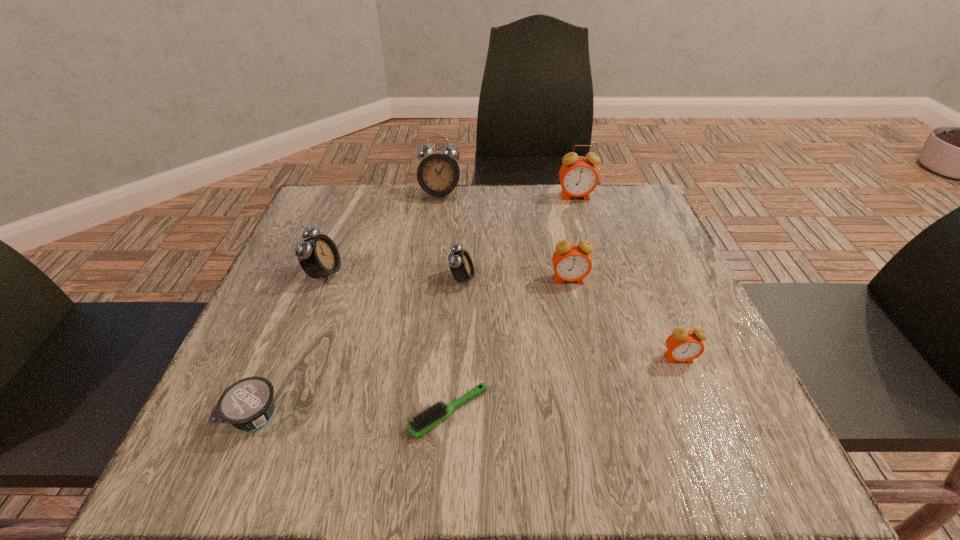
In the image, there is a desktop. Where is `vacant region at the near right corner`? The image size is (960, 540). vacant region at the near right corner is located at coordinates (780, 467).

At what (x,y) coordinates should I click in order to perform the action: click on empty location between the smallest white alarm clock and the seventh tallest object. Please return your answer as a coordinate pair (x, y). This screenshot has height=540, width=960. Looking at the image, I should click on (359, 347).

At what (x,y) coordinates should I click in order to perform the action: click on empty location between the smallest white alarm clock and the seventh tallest object. Please return your answer as a coordinate pair (x, y). This screenshot has width=960, height=540. Looking at the image, I should click on (359, 347).

Find the location of a particular element. The width and height of the screenshot is (960, 540). empty location between the rightmost object and the smallest white alarm clock is located at coordinates (570, 319).

At what (x,y) coordinates should I click in order to perform the action: click on vacant point located between the light hairbrush and the second smallest pink alarm clock. Please return your answer as a coordinate pair (x, y). Image resolution: width=960 pixels, height=540 pixels. Looking at the image, I should click on (509, 346).

You are a GUI agent. You are given a task and a screenshot of the screen. Output one action in this format:
    pyautogui.click(x=<x>, y=<y>)
    Task: Click on the empty space that is in between the rightmost object and the second farthest pink alarm clock
    This screenshot has width=960, height=540.
    Given the screenshot: What is the action you would take?
    pyautogui.click(x=624, y=319)

The height and width of the screenshot is (540, 960). Identify the location of free area in between the yogurt and the smallest white alarm clock. (359, 347).

The image size is (960, 540). What are the coordinates of `free space between the rightmost alarm clock and the hairbrush` in the screenshot? It's located at (564, 385).

What are the coordinates of `free space that is in between the second biggest white alarm clock and the biggest pink alarm clock` in the screenshot? It's located at (450, 235).

Image resolution: width=960 pixels, height=540 pixels. I want to click on free area in between the shortest object and the smallest white alarm clock, so 456,345.